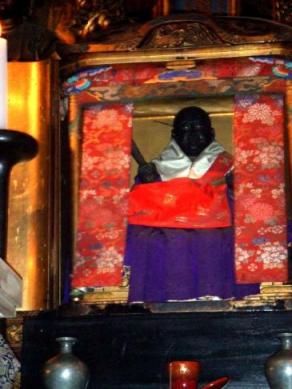
You are a GUI agent. You are given a task and a screenshot of the screen. Output one action in this format:
    pyautogui.click(x=<x>, y=<y>)
    Task: Click on the red cloth
    The height and width of the screenshot is (389, 292).
    Given the screenshot: What is the action you would take?
    [x=101, y=228], [x=259, y=221]